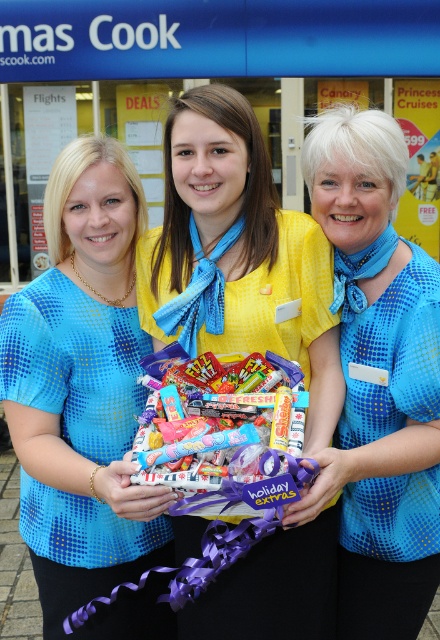
You are a customer looking to purchase the shiny plastic candy at center. The store has a rule that you must first ask the employee wearing the matte blue blouse at center for permission. However, the candy is currently placed behind the counter, which is 1.2 meters high. Can you reach the candy without assistance?

The matte blue blouse at center is bigger than the shiny plastic candy at center. Since the candy is behind a 1.2 meter high counter, you cannot reach it without assistance from the employee wearing the matte blue blouse at center.

You are a customer standing in front of the travel agency storefront. You notice two items at the center of the image. Which one is wider, the yellow fabric shirt at center or the shiny plastic candy at center?

The yellow fabric shirt at center might be wider than shiny plastic candy at center.

You are a customer looking at the two shirts worn by the employees in the image. The shirts are the matte blue blouse at center and the yellow fabric shirt at center. Which one is positioned more to the left?

The matte blue blouse at center is positioned more to the left than the yellow fabric shirt at center.